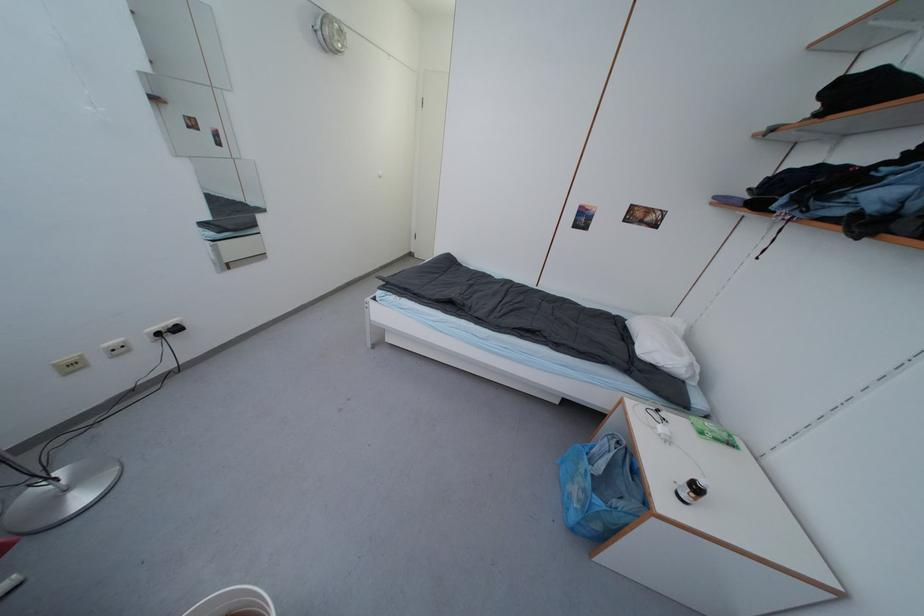
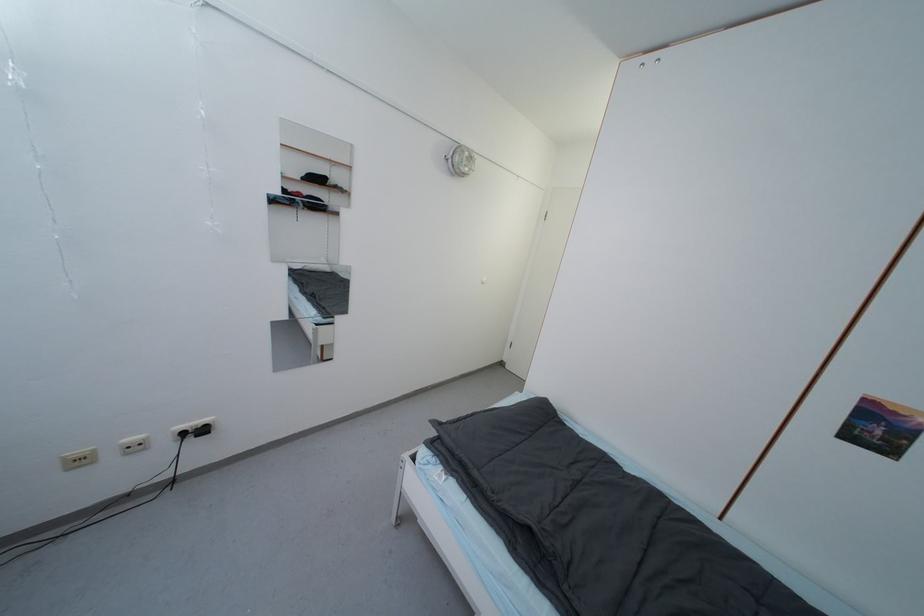
Question: I am providing you with two images of the same scene from different viewpoints. Please identify which objects are invisible in image2.

Choices:
 (A) black electric plug
 (B) white wall outlet
 (C) cabinet finger pull
 (D) none of these

Answer: (D)